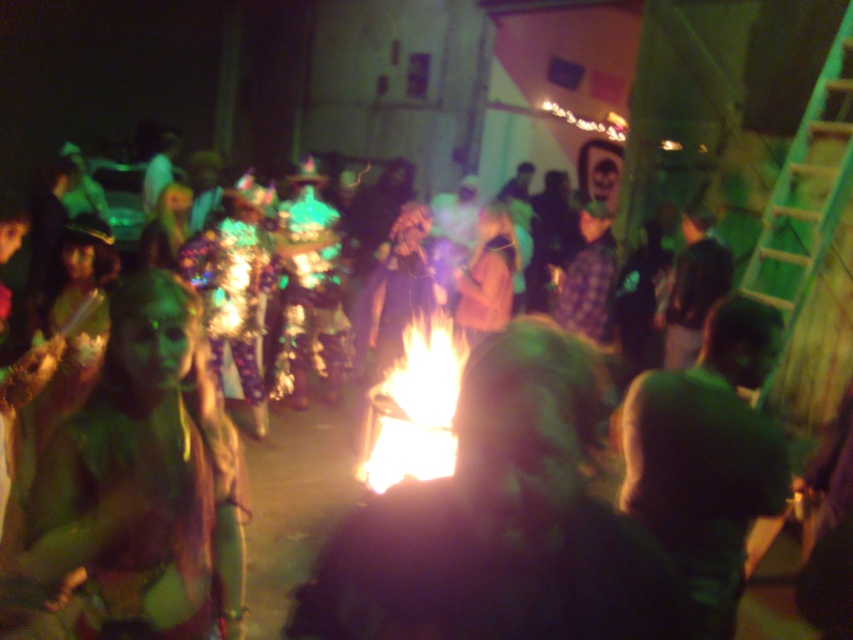
Which is above, green matte shirt at right or bright orange flames at center?

bright orange flames at center is higher up.

Who is taller, green matte shirt at right or bright orange flames at center?

green matte shirt at right is taller.

Is point (676, 528) closer to viewer compared to point (419, 358)?

Yes, point (676, 528) is closer to viewer.

This screenshot has width=853, height=640. Find the location of `green matte shirt at right`. green matte shirt at right is located at coordinates (706, 458).